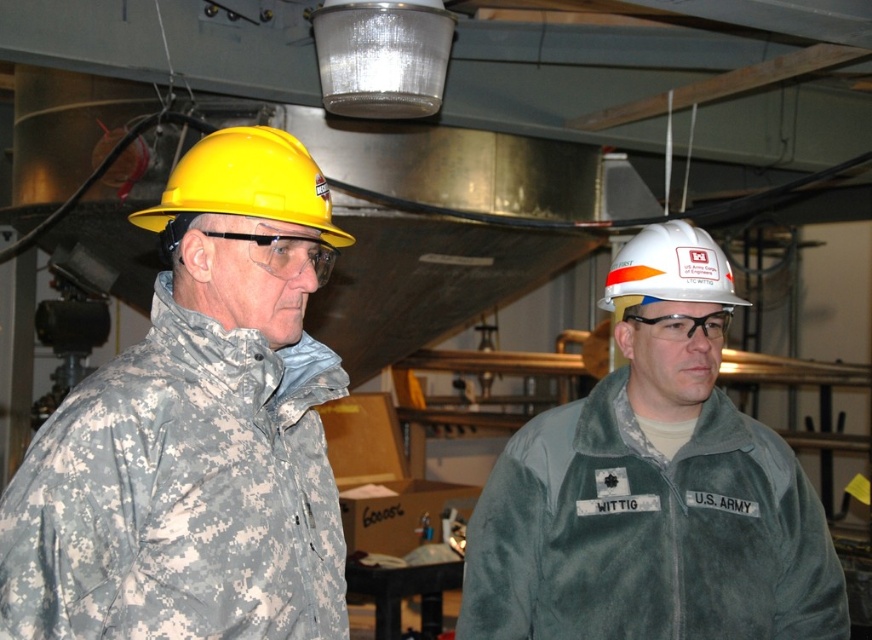
Does camouflage jacket at left have a greater width compared to yellow hard hat at left?

Yes.

Which is more to the left, camouflage jacket at left or yellow hard hat at left?

Positioned to the left is camouflage jacket at left.

Between point (58, 611) and point (298, 211), which one is positioned behind?

The point (298, 211) is more distant.

This screenshot has width=872, height=640. Identify the location of camouflage jacket at left. (196, 429).

Describe the element at coordinates (196, 429) in the screenshot. I see `camouflage jacket at left` at that location.

Consider the image. Is camouflage jacket at left in front of white matte hard hat at center?

Yes, camouflage jacket at left is in front of white matte hard hat at center.

Is point (203, 456) in front of point (649, 556)?

That is True.

The image size is (872, 640). What are the coordinates of `camouflage jacket at left` in the screenshot? It's located at (196, 429).

Who is positioned more to the left, camouflage jacket at left or white matte helmet at center?

From the viewer's perspective, camouflage jacket at left appears more on the left side.

Does camouflage jacket at left have a smaller size compared to white matte helmet at center?

Incorrect, camouflage jacket at left is not smaller in size than white matte helmet at center.

Identify the location of camouflage jacket at left. Image resolution: width=872 pixels, height=640 pixels. 196,429.